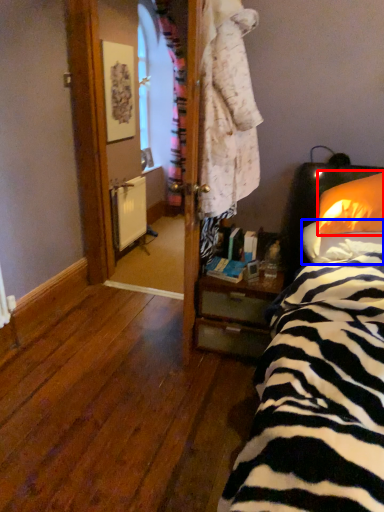
Question: Which of the following is the closest to the observer, pillow (highlighted by a red box) or pillow (highlighted by a blue box)?

Choices:
 (A) pillow
 (B) pillow

Answer: (B)